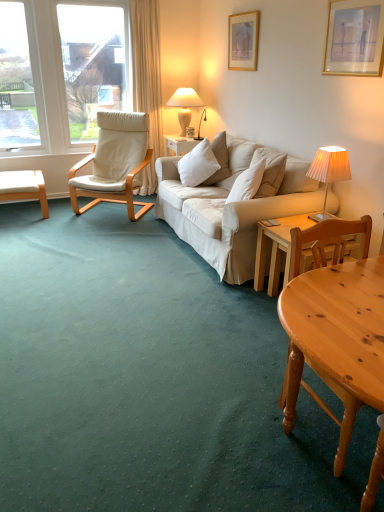
The height and width of the screenshot is (512, 384). What are the coordinates of `light brown wooden table at lower right` in the screenshot? It's located at (336, 330).

Describe the element at coordinates (336, 330) in the screenshot. The width and height of the screenshot is (384, 512). I see `light brown wooden table at lower right` at that location.

In order to face wooden framed artwork at upper right, marked as the first picture frame in a bottom-to-top arrangement, should I rotate leftwards or rightwards?

You should look right and rotate roughly 20.863 degrees.

What do you see at coordinates (354, 38) in the screenshot? I see `wooden framed artwork at upper right, which is the second picture frame in left-to-right order` at bounding box center [354, 38].

Measure the distance between point (136, 143) and camera.

A distance of 4.45 meters exists between point (136, 143) and camera.

Find the location of `white leather chair at left, placed as the 2th desk when sorted from bottom to top`. white leather chair at left, placed as the 2th desk when sorted from bottom to top is located at coordinates (24, 187).

The width and height of the screenshot is (384, 512). I want to click on pleated fabric lampshade at right, placed as the 2th lamp when sorted from top to bottom, so click(330, 167).

Is white glossy lamp at upper center, the second lamp ordered from the bottom, positioned in front of white leather chair at left?

No, it is not.

Is point (172, 95) farther from viewer compared to point (107, 114)?

Yes, it is.

Image resolution: width=384 pixels, height=512 pixels. I want to click on chair that is under the white glossy lamp at upper center, the 2th lamp positioned from the front (from a real-world perspective), so click(114, 163).

How many degrees apart are the facing directions of white glossy lamp at upper center, the second lamp ordered from the bottom, and white leather chair at left?

45 degrees separate the facing orientations of white glossy lamp at upper center, the second lamp ordered from the bottom, and white leather chair at left.

From the image's perspective, is pleated fabric lampshade at right, which is counted as the first lamp, starting from the bottom, positioned above or below white leather chair at left, placed as the 1th desk when sorted from back to front?

pleated fabric lampshade at right, which is counted as the first lamp, starting from the bottom, is below white leather chair at left, placed as the 1th desk when sorted from back to front.

Can you confirm if pleated fabric lampshade at right, which is the 2th lamp from left to right, is smaller than white leather chair at left, which is counted as the 2th desk, starting from the front?

Correct, pleated fabric lampshade at right, which is the 2th lamp from left to right, occupies less space than white leather chair at left, which is counted as the 2th desk, starting from the front.

Can you confirm if pleated fabric lampshade at right, positioned as the second lamp in back-to-front order, is positioned to the right of white leather chair at left, which is counted as the 2th desk, starting from the front?

Indeed, pleated fabric lampshade at right, positioned as the second lamp in back-to-front order, is positioned on the right side of white leather chair at left, which is counted as the 2th desk, starting from the front.

Which of these two, light wood desk at lower right, which ranks as the 1th desk in bottom-to-top order, or light brown wooden table at lower right, is smaller?

light wood desk at lower right, which ranks as the 1th desk in bottom-to-top order, is smaller.

How much distance is there between light wood desk at lower right, which ranks as the 1th desk in bottom-to-top order, and light brown wooden table at lower right?

They are 55.40 centimeters apart.

From a real-world perspective, which object rests below the other?

light wood desk at lower right, which ranks as the 1th desk in bottom-to-top order, from a real-world perspective.

From the image's perspective, who appears lower, light wood desk at lower right, the 1th desk positioned from the front, or light brown wooden table at lower right?

light brown wooden table at lower right is shown below in the image.

Does wooden picture frame at upper center, positioned as the second picture frame in right-to-left order, turn towards light wood desk at lower right, which is the 2th desk in left-to-right order?

No, wooden picture frame at upper center, positioned as the second picture frame in right-to-left order, is not turned towards light wood desk at lower right, which is the 2th desk in left-to-right order.

Measure the distance between wooden picture frame at upper center, the 2th picture frame in the front-to-back sequence, and light wood desk at lower right, which ranks as the 1th desk in bottom-to-top order.

A distance of 6.94 feet exists between wooden picture frame at upper center, the 2th picture frame in the front-to-back sequence, and light wood desk at lower right, which ranks as the 1th desk in bottom-to-top order.

From the image's perspective, between wooden picture frame at upper center, positioned as the first picture frame in left-to-right order, and light wood desk at lower right, which ranks as the 1th desk in bottom-to-top order, which one is located above?

wooden picture frame at upper center, positioned as the first picture frame in left-to-right order.

Can you tell me how much wooden picture frame at upper center, the first picture frame viewed from the back, and light wood desk at lower right, which is the 2th desk in left-to-right order, differ in facing direction?

The angle between the facing direction of wooden picture frame at upper center, the first picture frame viewed from the back, and the facing direction of light wood desk at lower right, which is the 2th desk in left-to-right order, is 1.55 degrees.

Is wooden picture frame at upper center, which is counted as the first picture frame, starting from the top, aimed at white soft cushion at center?

No, wooden picture frame at upper center, which is counted as the first picture frame, starting from the top, does not turn towards white soft cushion at center.

Who is smaller, wooden picture frame at upper center, which is counted as the first picture frame, starting from the top, or white soft cushion at center?

wooden picture frame at upper center, which is counted as the first picture frame, starting from the top, is smaller.

Does wooden picture frame at upper center, which is counted as the first picture frame, starting from the top, have a lesser width compared to white soft cushion at center?

Yes.

Find the location of a particular element. pillow below the wooden picture frame at upper center, marked as the 2th picture frame in a bottom-to-top arrangement (from the image's perspective) is located at coordinates (197, 164).

From a real-world perspective, between white leather chair at left, placed as the 2th desk when sorted from bottom to top, and pleated fabric lampshade at right, placed as the 1th lamp when sorted from front to back, who is vertically higher?

pleated fabric lampshade at right, placed as the 1th lamp when sorted from front to back, from a real-world perspective.

Between point (28, 195) and point (321, 169), which one is positioned behind?

The point (28, 195) is farther.

Would you say white leather chair at left, arranged as the second desk when viewed from the right, is inside or outside pleated fabric lampshade at right, positioned as the first lamp in right-to-left order?

white leather chair at left, arranged as the second desk when viewed from the right, exists outside the volume of pleated fabric lampshade at right, positioned as the first lamp in right-to-left order.

From the image's perspective, relative to wooden framed artwork at upper right, which is the second picture frame from top to bottom, is white leather chair at left, which is counted as the 1th desk, starting from the left, above or below?

white leather chair at left, which is counted as the 1th desk, starting from the left, is below wooden framed artwork at upper right, which is the second picture frame from top to bottom.

Identify the location of picture frame that is the 2nd object located in front of the white leather chair at left, arranged as the second desk when viewed from the right. Image resolution: width=384 pixels, height=512 pixels. (354, 38).

Considering the relative sizes of white leather chair at left, which is counted as the 1th desk, starting from the left, and wooden framed artwork at upper right, marked as the first picture frame in a bottom-to-top arrangement, in the image provided, is white leather chair at left, which is counted as the 1th desk, starting from the left, shorter than wooden framed artwork at upper right, marked as the first picture frame in a bottom-to-top arrangement,?

Yes, white leather chair at left, which is counted as the 1th desk, starting from the left, is shorter than wooden framed artwork at upper right, marked as the first picture frame in a bottom-to-top arrangement.

In terms of size, does white leather chair at left, placed as the 2th desk when sorted from bottom to top, appear bigger or smaller than wooden framed artwork at upper right, marked as the first picture frame in a bottom-to-top arrangement?

white leather chair at left, placed as the 2th desk when sorted from bottom to top, is bigger than wooden framed artwork at upper right, marked as the first picture frame in a bottom-to-top arrangement.

I want to click on lamp that is the 2nd one above the white leather chair at left (from a real-world perspective), so click(186, 106).

Identify the location of desk above the pleated fabric lampshade at right, which is the 2th lamp from left to right (from the image's perspective). (24, 187).

Based on their spatial positions, is white glossy lamp at upper center, marked as the 1th lamp in a left-to-right arrangement, or light wood desk at lower right, which is the 2th desk in left-to-right order, further from pleated fabric lampshade at right, placed as the 1th lamp when sorted from front to back?

white glossy lamp at upper center, marked as the 1th lamp in a left-to-right arrangement.

Considering their positions, is light brown wooden table at lower right positioned further to wooden picture frame at upper center, which is counted as the first picture frame, starting from the top, than white leather chair at left, which is counted as the 1th desk, starting from the left?

light brown wooden table at lower right.

From the image, which object appears to be farther from white soft cushion at center, light brown wooden table at lower right or white leather chair at left?

light brown wooden table at lower right.

From the picture: Estimate the real-world distances between objects in this image. Which object is closer to wooden picture frame at upper center, which is counted as the first picture frame, starting from the top, pleated fabric lampshade at right, which is counted as the first lamp, starting from the bottom, or wooden framed artwork at upper right, marked as the first picture frame in a bottom-to-top arrangement?

wooden framed artwork at upper right, marked as the first picture frame in a bottom-to-top arrangement, is positioned closer to the anchor wooden picture frame at upper center, which is counted as the first picture frame, starting from the top.

Which object lies further to the anchor point white soft cushion at center, white leather chair at left, the first desk in the top-to-bottom sequence, or white leather chair at left?

Among the two, white leather chair at left, the first desk in the top-to-bottom sequence, is located further to white soft cushion at center.

Looking at the image, which one is located further to white leather chair at left, wooden picture frame at upper center, the first picture frame viewed from the back, or pleated fabric lampshade at right, which is counted as the first lamp, starting from the bottom?

Based on the image, pleated fabric lampshade at right, which is counted as the first lamp, starting from the bottom, appears to be further to white leather chair at left.

Looking at the image, which one is located closer to wooden framed artwork at upper right, the first picture frame viewed from the right, wooden picture frame at upper center, positioned as the first picture frame in left-to-right order, or pleated fabric lampshade at right, placed as the 2th lamp when sorted from top to bottom?

pleated fabric lampshade at right, placed as the 2th lamp when sorted from top to bottom, is closer to wooden framed artwork at upper right, the first picture frame viewed from the right.

Which object lies nearer to the anchor point wooden framed artwork at upper right, which appears as the 1th picture frame when viewed from the front, pleated fabric lampshade at right, placed as the 2th lamp when sorted from top to bottom, or white leather chair at left?

Based on the image, pleated fabric lampshade at right, placed as the 2th lamp when sorted from top to bottom, appears to be nearer to wooden framed artwork at upper right, which appears as the 1th picture frame when viewed from the front.

The width and height of the screenshot is (384, 512). I want to click on chair between white leather chair at left, placed as the 2th desk when sorted from bottom to top, and wooden framed artwork at upper right, which is the second picture frame from top to bottom, so click(x=114, y=163).

Where is `chair between pleated fabric lampshade at right, positioned as the second lamp in back-to-front order, and white glossy lamp at upper center, the 2th lamp positioned from the front, in the front-back direction`? chair between pleated fabric lampshade at right, positioned as the second lamp in back-to-front order, and white glossy lamp at upper center, the 2th lamp positioned from the front, in the front-back direction is located at coordinates (114, 163).

Find the location of a particular element. pillow between pleated fabric lampshade at right, positioned as the first lamp in right-to-left order, and white glossy lamp at upper center, the 2th lamp positioned from the front, from front to back is located at coordinates (197, 164).

This screenshot has width=384, height=512. I want to click on pillow between white leather chair at left and wooden picture frame at upper center, marked as the 2th picture frame in a bottom-to-top arrangement, in the horizontal direction, so click(197, 164).